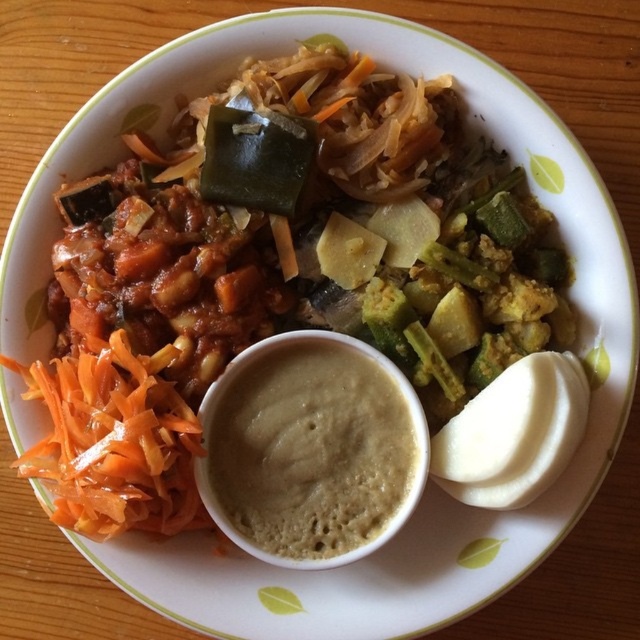
You are looking at the plate of food and notice two points marked on it. Which of the two points, point (244, 358) or point (93, 486), is closer to you?

Point (244, 358) is closer to you than point (93, 486).

You are arranging a food platter and need to place the smooth beige dip at center. According to the image, where exactly should you position it relative to the shredded carrots on the left and other vegetables?

The smooth beige dip at center should be placed at the coordinates point (310, 449), which is the center of the plate as per the image description.

You are a food stylist arranging this plate. You need to place a garnish between the smooth beige dip at center and the orange shredded carrot at lower left. Where should you place it?

The smooth beige dip at center is positioned on the right side of the orange shredded carrot at lower left, so you should place the garnish between them by positioning it to the right of the orange shredded carrot at lower left and to the left of the smooth beige dip at center.